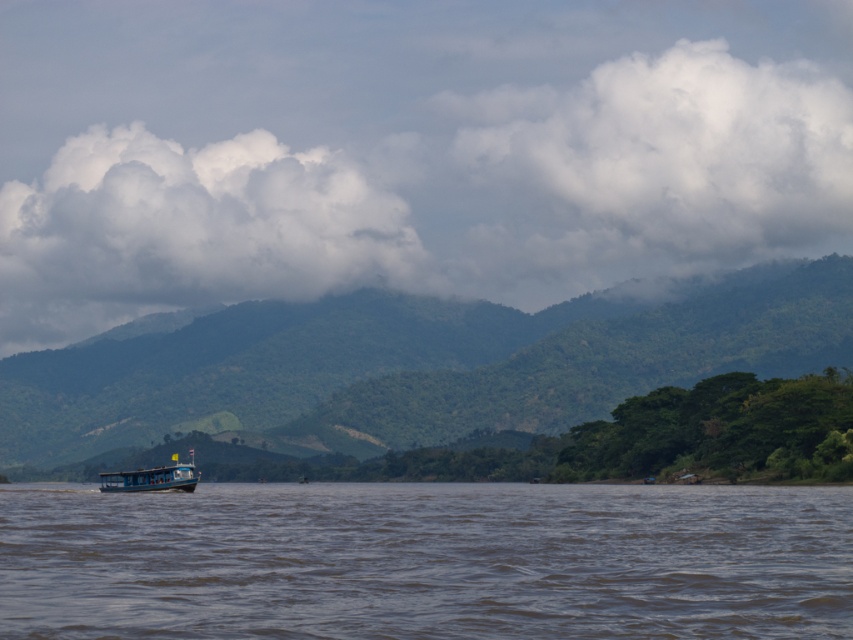
You are a photographer planning to capture the blue wooden boat at center and the green leafy forest at center in a single shot. Based on their positions, which object will appear closer to the top of the photo?

Answer: The green leafy forest at center is positioned over the blue wooden boat at center, so it will appear closer to the top of the photo.

You are a fisherman standing on the riverbank. You see the brown muddy water at lower center and the blue wooden boat at center. Which object is higher in elevation?

The brown muddy water at lower center is much taller than the blue wooden boat at center, so the brown muddy water at lower center has a higher elevation.

You are standing on the riverbank and see the brown muddy water at lower center and the green leafy forest at center. Which object is closer to your feet?

The brown muddy water at lower center is closer to your feet since it is located below the green leafy forest at center.